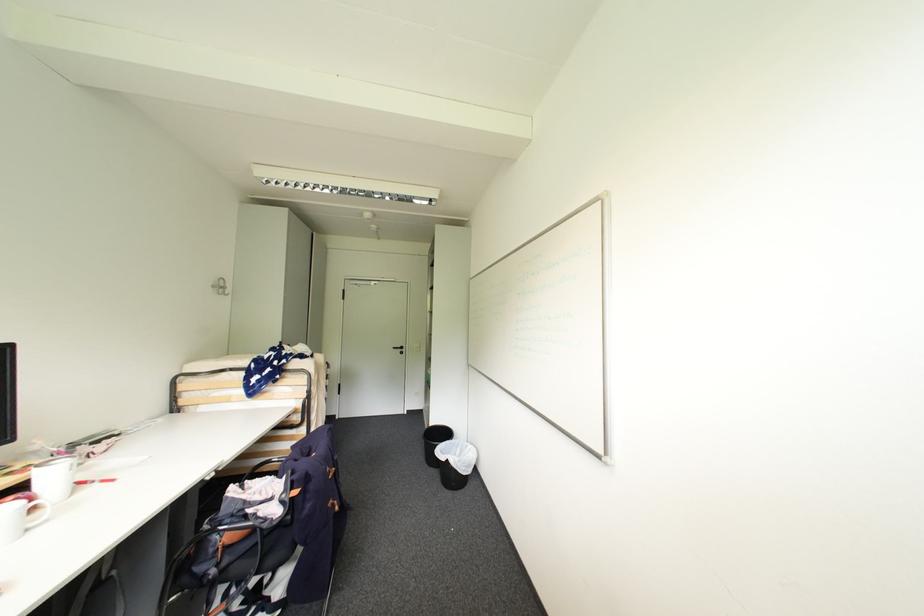
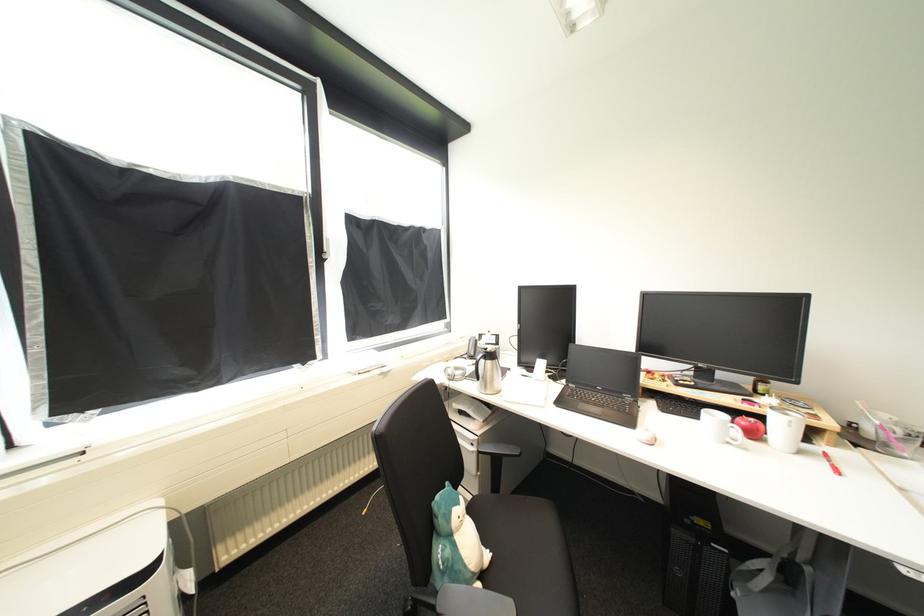
In the second image, find the point that corresponds to (34,531) in the first image.

(736, 445)